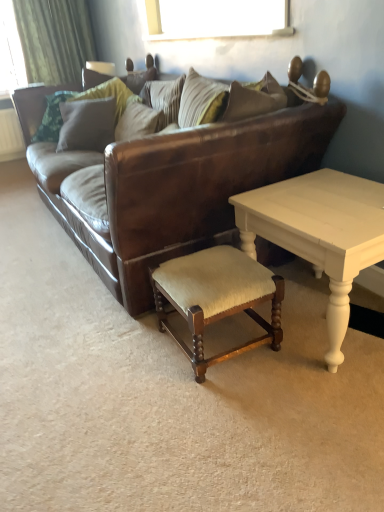
This screenshot has height=512, width=384. In order to click on vacant area on top of white painted wood coffee table at right (from a real-world perspective) in this screenshot , I will do `click(325, 197)`.